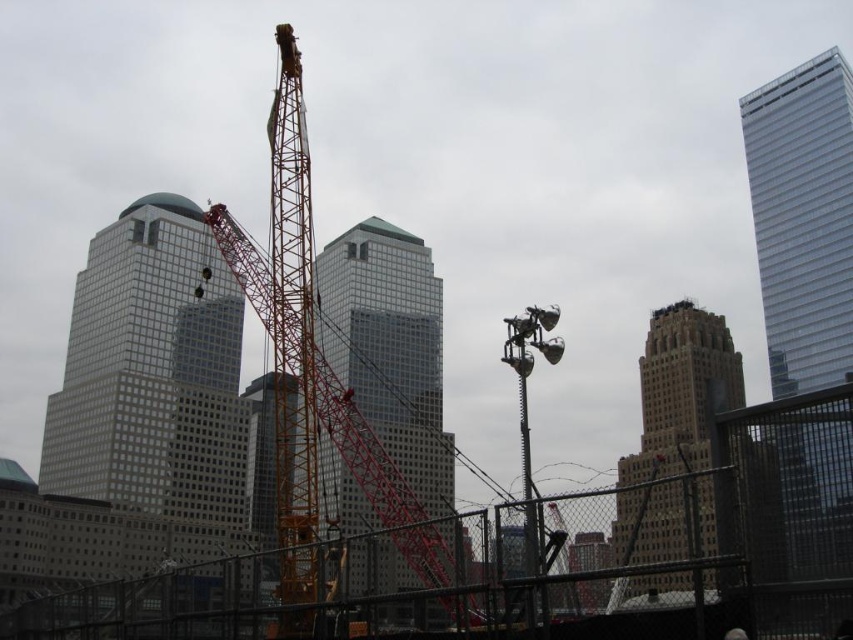
Question: Does matte glass skyscraper at left appear over brown stone tower at center?

Choices:
 (A) no
 (B) yes

Answer: (B)

Question: Which object is positioned closest to the yellow metallic crane at center?

Choices:
 (A) glassy steel skyscraper at center
 (B) clear glass skyscraper at upper right
 (C) brown stone tower at center

Answer: (A)

Question: Which object appears closest to the camera in this image?

Choices:
 (A) matte glass skyscraper at left
 (B) yellow metallic crane at center

Answer: (B)

Question: Which point appears closest to the camera in this image?

Choices:
 (A) coord(792,572)
 (B) coord(169,500)
 (C) coord(349,244)
 (D) coord(804,371)

Answer: (A)

Question: Can you confirm if matte glass skyscraper at left is positioned above clear glass skyscraper at upper right?

Choices:
 (A) no
 (B) yes

Answer: (A)

Question: Can you confirm if glassy steel skyscraper at center is positioned below brown stone tower at center?

Choices:
 (A) yes
 (B) no

Answer: (B)